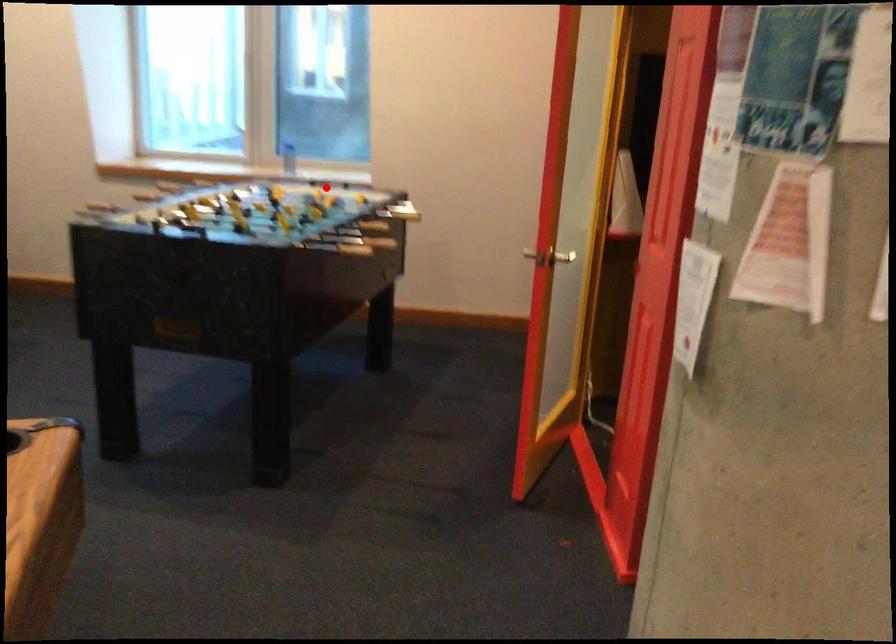
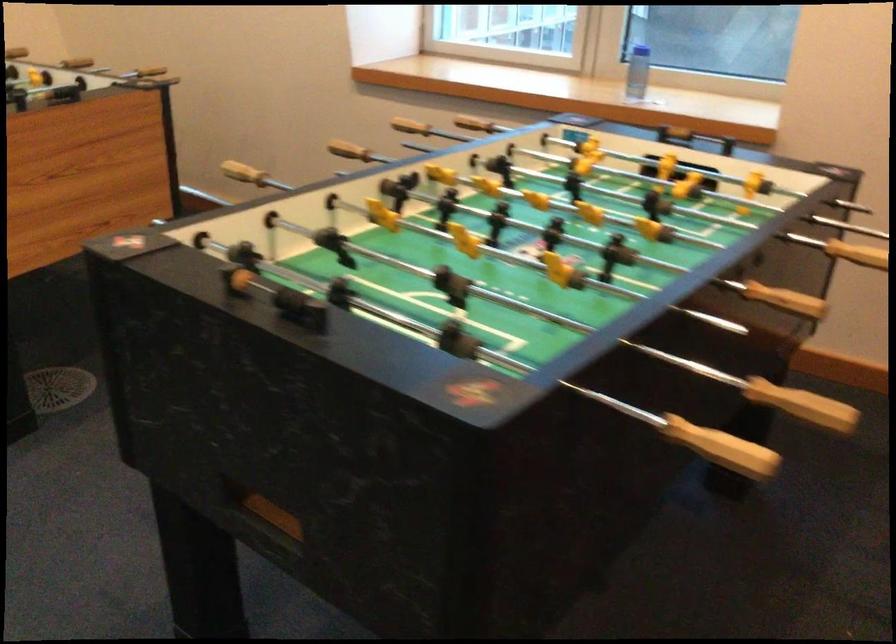
Find the pixel in the second image that matches the highlighted location in the first image.

(678, 172)